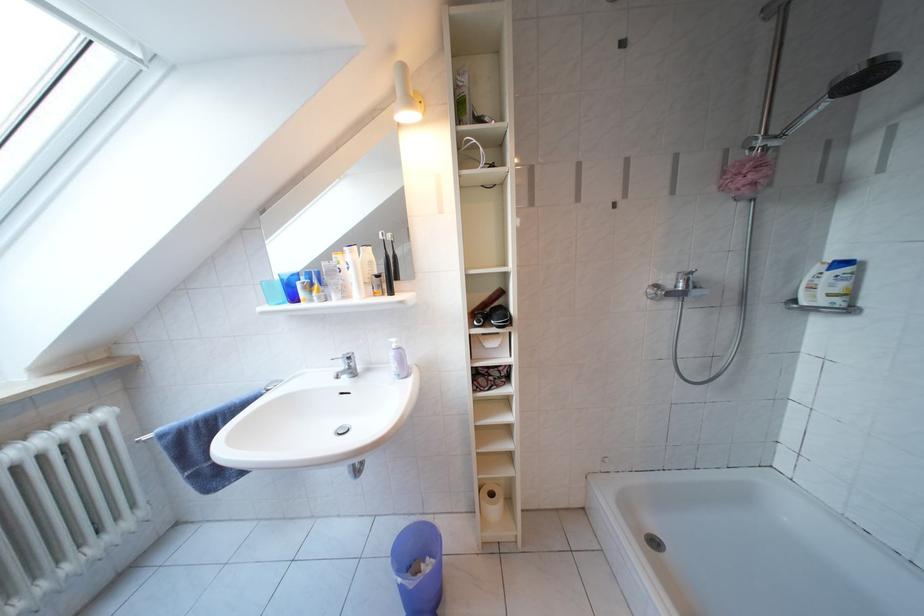
This screenshot has height=616, width=924. Describe the element at coordinates (346, 366) in the screenshot. I see `the faucet handle` at that location.